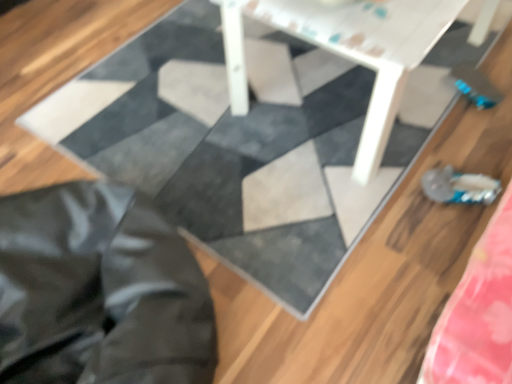
The height and width of the screenshot is (384, 512). Describe the element at coordinates (349, 50) in the screenshot. I see `white plastic table at center` at that location.

I want to click on white plastic table at center, so click(x=349, y=50).

What are the coordinates of `white plastic table at center` in the screenshot? It's located at (349, 50).